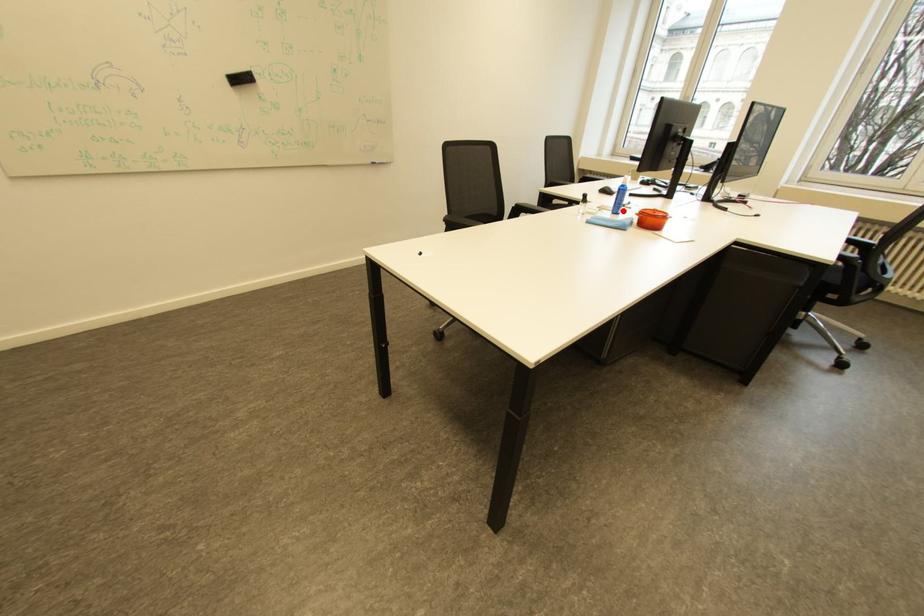
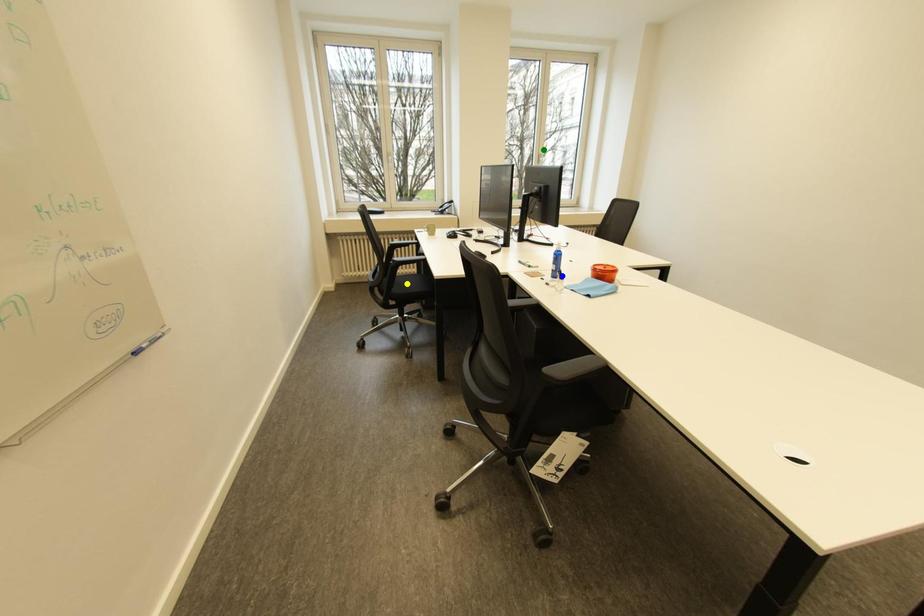
Question: I am providing you with two images of the same scene from different viewpoints. A red point is marked on the first image. You are given multiple points on the second image. Which spot in image 2 lines up with the point in image 1?

Choices:
 (A) blue point
 (B) green point
 (C) yellow point

Answer: (A)